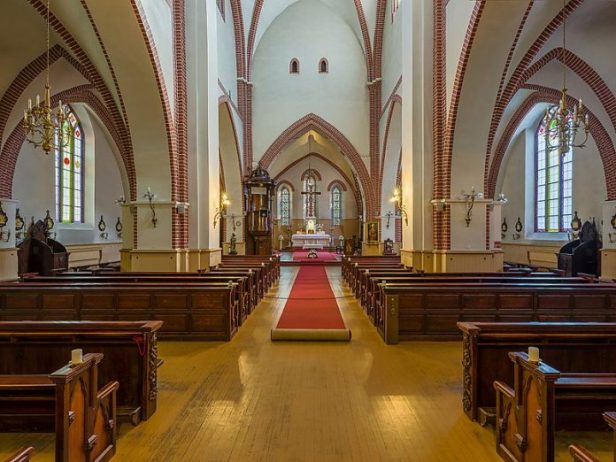
The width and height of the screenshot is (616, 462). I want to click on wood flooring, so click(x=281, y=396).